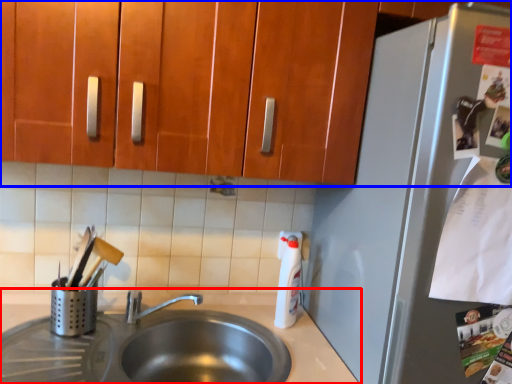
Question: Which of the following is the farthest to the observer, countertop (highlighted by a red box) or cabinetry (highlighted by a blue box)?

Choices:
 (A) countertop
 (B) cabinetry

Answer: (A)